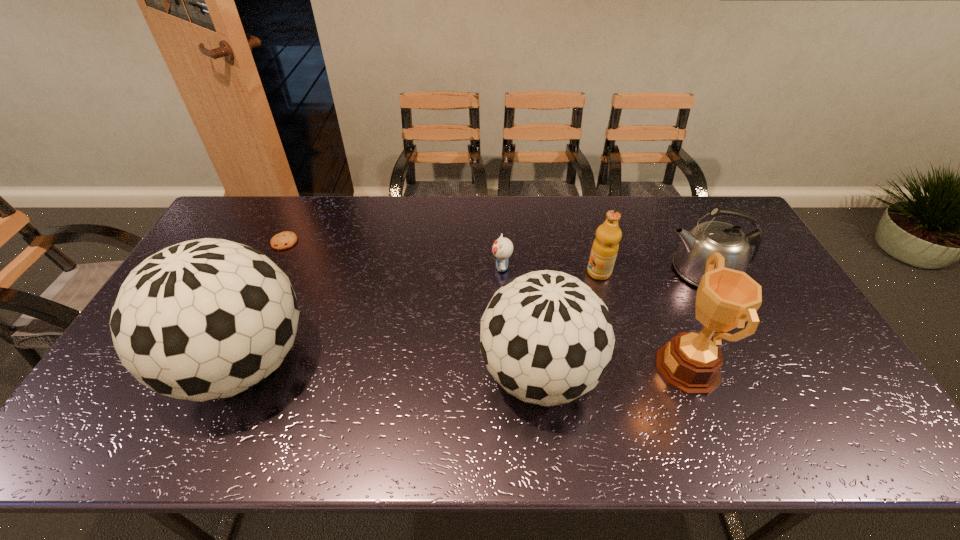
You are a GUI agent. You are given a task and a screenshot of the screen. Output one action in this format:
    pyautogui.click(x=<x>, y=<y>)
    Task: Click on the object that is the fifth closest to the kettle
    The width and height of the screenshot is (960, 540).
    Given the screenshot: What is the action you would take?
    pyautogui.click(x=205, y=319)

At what (x,y) coordinates should I click in order to perform the action: click on object that stands as the closest to the shorter soccer ball. Please return your answer as a coordinate pair (x, y). Image resolution: width=960 pixels, height=540 pixels. Looking at the image, I should click on (691, 362).

Where is `free location that satisfies the following two spatial constraints: 1. on the back side of the shorter soccer ball; 2. on the front-facing side of the second shortest object`? This screenshot has height=540, width=960. free location that satisfies the following two spatial constraints: 1. on the back side of the shorter soccer ball; 2. on the front-facing side of the second shortest object is located at coordinates (528, 267).

This screenshot has height=540, width=960. I want to click on free space that satisfies the following two spatial constraints: 1. on the front-facing side of the sixth tallest object; 2. on the right side of the right soccer ball, so click(x=507, y=374).

Identify the location of free spot that satisfies the following two spatial constraints: 1. on the front-facing side of the kitten; 2. on the left side of the right soccer ball. The image size is (960, 540). (507, 374).